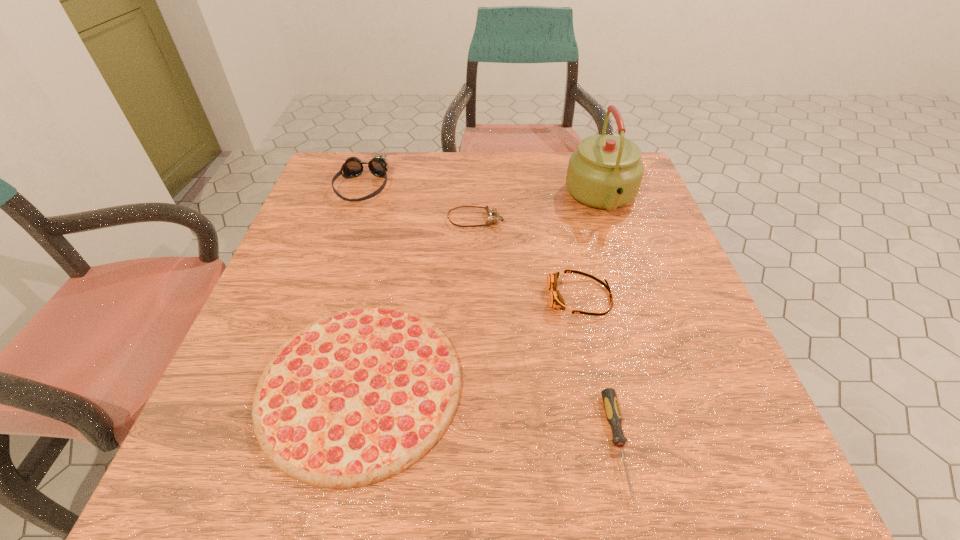
Locate an element on the screen. The image size is (960, 540). unoccupied area between the kettle and the nearest goggles is located at coordinates [x=590, y=248].

At what (x,y) coordinates should I click in order to perform the action: click on object that can be found as the second closest to the pizza. Please return your answer as a coordinate pair (x, y). Looking at the image, I should click on (612, 410).

The height and width of the screenshot is (540, 960). In order to click on object that is the closest to the screwdriver in this screenshot , I will do `click(556, 301)`.

Image resolution: width=960 pixels, height=540 pixels. Identify the location of goggles that stands as the third closest to the screwdriver. (353, 167).

In order to click on goggles that is the second closest one to the pizza in this screenshot , I will do `click(492, 212)`.

Where is `free location that satisfies the following two spatial constraints: 1. at the spout of the kettle; 2. with the lenses facing forward on the third tallest object`? This screenshot has height=540, width=960. free location that satisfies the following two spatial constraints: 1. at the spout of the kettle; 2. with the lenses facing forward on the third tallest object is located at coordinates coord(636,298).

Locate an element on the screen. vacant space that satisfies the following two spatial constraints: 1. through the lenses of the pizza; 2. on the right side of the tallest goggles is located at coordinates (296, 386).